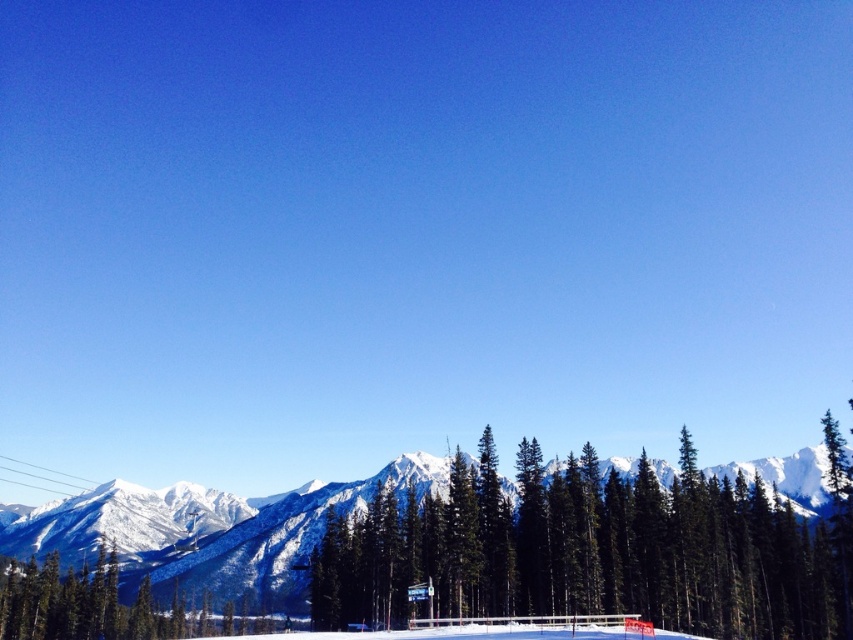
You are an environmental scientist assessing the health of a forest. You observe two green matte trees in the scene. Which tree, the green matte tree at center or the green matte tree at lower left, is taller?

The green matte tree at center is taller than the green matte tree at lower left.

You are standing at point (595, 550) in the winter landscape. What object is located at this point?

The green matte tree at center is located at point (595, 550).